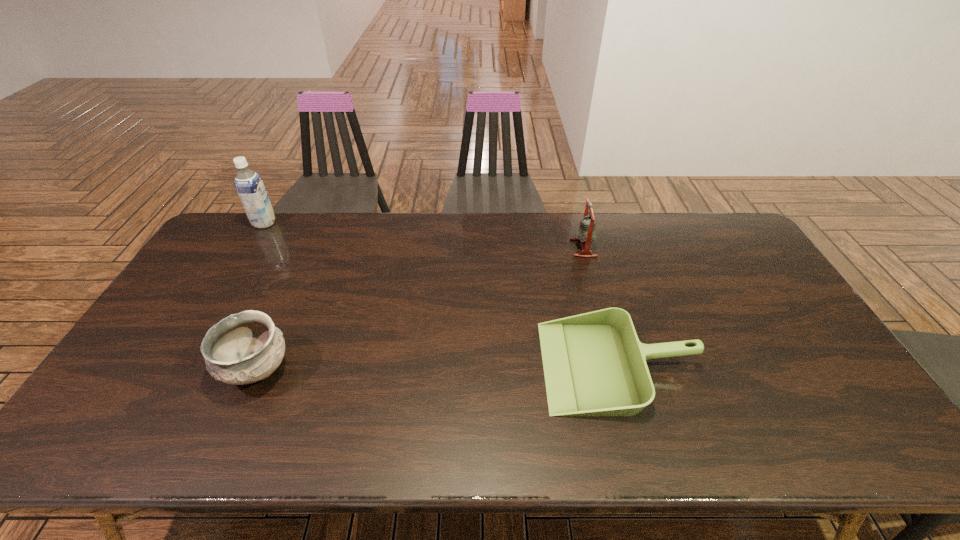
Locate an element on the screen. Image resolution: width=960 pixels, height=540 pixels. empty space between the soya milk and the third nearest object is located at coordinates (424, 235).

Locate an element on the screen. The height and width of the screenshot is (540, 960). vacant point located between the pottery and the farthest object is located at coordinates (261, 296).

Where is `free space between the bell and the second shortest object`? This screenshot has width=960, height=540. free space between the bell and the second shortest object is located at coordinates (420, 309).

This screenshot has height=540, width=960. What are the coordinates of `vacant region between the third object from right to left and the farthest object` in the screenshot? It's located at tap(261, 296).

At what (x,y) coordinates should I click in order to perform the action: click on object that is the second closest to the soya milk. Please return your answer as a coordinate pair (x, y). This screenshot has width=960, height=540. Looking at the image, I should click on (594, 364).

This screenshot has width=960, height=540. Find the location of `the third closest object to the second shortest object`. the third closest object to the second shortest object is located at coordinates (586, 233).

The height and width of the screenshot is (540, 960). I want to click on vacant area that satisfies the following two spatial constraints: 1. on the scoop of the shortest object; 2. on the front side of the third object from right to left, so click(619, 370).

Locate an element on the screen. The height and width of the screenshot is (540, 960). free location that satisfies the following two spatial constraints: 1. on the label of the third object from right to left; 2. on the right side of the soya milk is located at coordinates (176, 370).

Where is `vacant area that satisfies the following two spatial constraints: 1. on the label of the farthest object; 2. on the right side of the third object from right to left`? Image resolution: width=960 pixels, height=540 pixels. vacant area that satisfies the following two spatial constraints: 1. on the label of the farthest object; 2. on the right side of the third object from right to left is located at coordinates (176, 370).

You are a GUI agent. You are given a task and a screenshot of the screen. Output one action in this format:
    pyautogui.click(x=<x>, y=<y>)
    Task: Click on the vacant point that satisfies the following two spatial constraints: 1. on the label of the soya milk; 2. on the back side of the third shortest object
    The height and width of the screenshot is (540, 960).
    Given the screenshot: What is the action you would take?
    pyautogui.click(x=250, y=248)